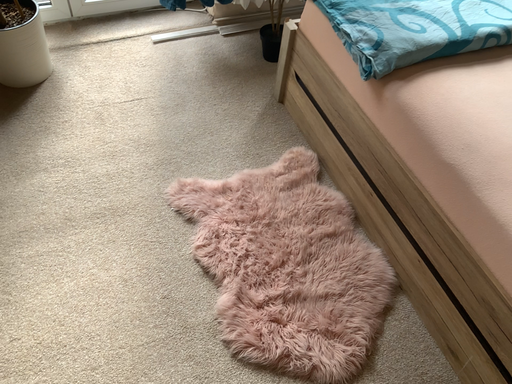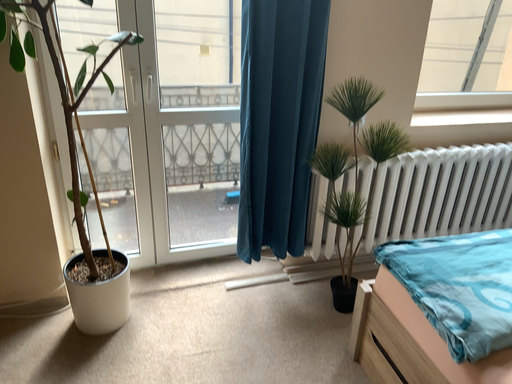
Question: Which way did the camera rotate in the video?

Choices:
 (A) rotated upward
 (B) rotated downward

Answer: (A)